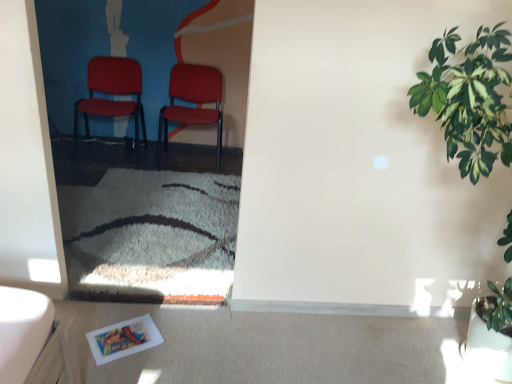
Question: Is matte plastic chair at center, which is the 2th chair from right to left, surrounded by green leafy plant at right?

Choices:
 (A) no
 (B) yes

Answer: (A)

Question: From a real-world perspective, is green leafy plant at right over matte plastic chair at center, which is the 2th chair from right to left?

Choices:
 (A) no
 (B) yes

Answer: (B)

Question: Can you confirm if green leafy plant at right is taller than matte plastic chair at center, which ranks as the first chair in left-to-right order?

Choices:
 (A) yes
 (B) no

Answer: (A)

Question: Is green leafy plant at right oriented away from matte plastic chair at center, which ranks as the first chair in left-to-right order?

Choices:
 (A) no
 (B) yes

Answer: (A)

Question: Does green leafy plant at right appear on the left side of matte plastic chair at center, which is the 2th chair from right to left?

Choices:
 (A) no
 (B) yes

Answer: (A)

Question: Considering the positions of matte plastic chair at center, which ranks as the first chair in left-to-right order, and matte red chair at center, marked as the 1th chair in a right-to-left arrangement, in the image, is matte plastic chair at center, which ranks as the first chair in left-to-right order, taller or shorter than matte red chair at center, marked as the 1th chair in a right-to-left arrangement,?

Choices:
 (A) tall
 (B) short

Answer: (A)

Question: Is matte plastic chair at center, which ranks as the first chair in left-to-right order, to the left or to the right of matte red chair at center, marked as the 1th chair in a right-to-left arrangement, in the image?

Choices:
 (A) left
 (B) right

Answer: (A)

Question: In terms of size, does matte plastic chair at center, which is the 2th chair from right to left, appear bigger or smaller than matte red chair at center, which is the second chair in left-to-right order?

Choices:
 (A) small
 (B) big

Answer: (B)

Question: From a real-world perspective, relative to matte red chair at center, marked as the 1th chair in a right-to-left arrangement, is matte plastic chair at center, which is the 2th chair from right to left, vertically above or below?

Choices:
 (A) above
 (B) below

Answer: (A)

Question: From the image's perspective, relative to green leafy plant at right, is matte red chair at center, which is the second chair in left-to-right order, above or below?

Choices:
 (A) above
 (B) below

Answer: (A)

Question: Is point (217, 117) closer or farther from the camera than point (499, 153)?

Choices:
 (A) closer
 (B) farther

Answer: (B)

Question: Based on their positions, is matte red chair at center, which is the second chair in left-to-right order, located to the left or right of green leafy plant at right?

Choices:
 (A) left
 (B) right

Answer: (A)

Question: Looking at their shapes, would you say matte red chair at center, which is the second chair in left-to-right order, is wider or thinner than green leafy plant at right?

Choices:
 (A) thin
 (B) wide

Answer: (A)

Question: Is point (440, 115) positioned closer to the camera than point (173, 102)?

Choices:
 (A) closer
 (B) farther

Answer: (A)

Question: From a real-world perspective, is green leafy plant at right positioned above or below matte red chair at center, marked as the 1th chair in a right-to-left arrangement?

Choices:
 (A) above
 (B) below

Answer: (A)